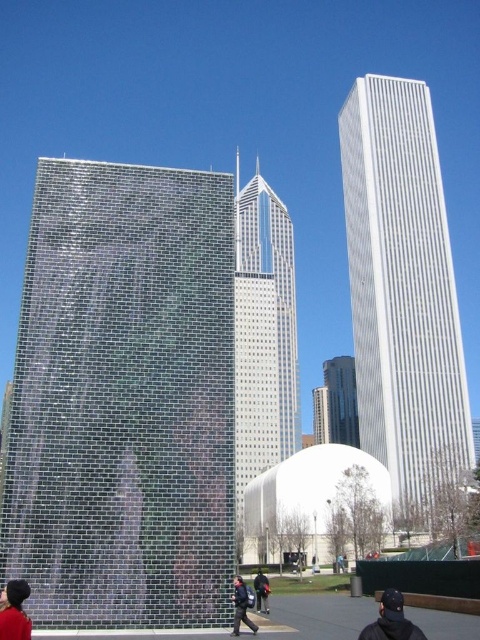
Does black fabric cap at center appear on the right side of blue denim jacket at lower center?

In fact, black fabric cap at center is to the left of blue denim jacket at lower center.

Between point (380, 616) and point (337, 564), which one is positioned in front?

Point (380, 616) is in front.

Is point (399, 600) positioned behind point (340, 556)?

No, (399, 600) is closer to viewer.

Where is `black fabric cap at center`? The height and width of the screenshot is (640, 480). black fabric cap at center is located at coordinates point(392,620).

Who is more distant from viewer, (373,236) or (395,602)?

The point (373,236) is more distant.

Which is below, white glossy skyscraper at right or black fabric cap at center?

Positioned lower is black fabric cap at center.

Between point (381, 460) and point (411, 634), which one is positioned behind?

Point (381, 460)

I want to click on white glossy skyscraper at right, so click(x=403, y=294).

Which is above, reflective glass tower at center or dark blue uniform at center?

reflective glass tower at center is above.

Can you confirm if reflective glass tower at center is smaller than dark blue uniform at center?

No.

Measure the distance between point (69, 232) and camera.

They are 22.48 meters apart.

Find the location of a particular element. The height and width of the screenshot is (640, 480). reflective glass tower at center is located at coordinates (123, 397).